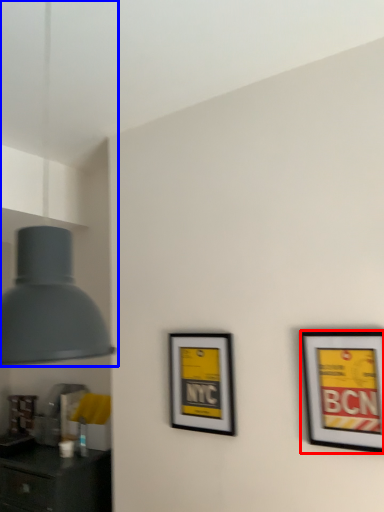
Question: Which point is further to the camera, picture frame (highlighted by a red box) or lamp (highlighted by a blue box)?

Choices:
 (A) picture frame
 (B) lamp

Answer: (A)